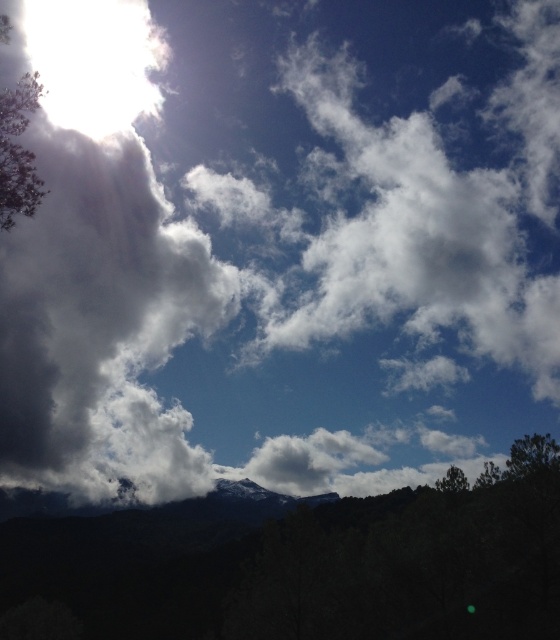
You are standing at the camera position and want to take a photo of the green leafy tree at upper left. If your camera has a maximum focus range of 130 meters, will you be able to focus on the tree?

The green leafy tree at upper left is 133.52 meters from camera, which is beyond the camera maximum focus range of 130 meters. Therefore, you won not be able to focus on the tree.

You are an observer looking at the image. You notice the green leafy tree at upper left and the green matte tree at lower right. Which tree appears nearer to you?

The green leafy tree at upper left appears nearer because it is closer to the viewer than the green matte tree at lower right.

You are an observer looking at the image. You see the green leafy tree at upper left and the green matte tree at lower right. Which tree is positioned more to the left side of the image?

The green leafy tree at upper left is positioned more to the left than the green matte tree at lower right.